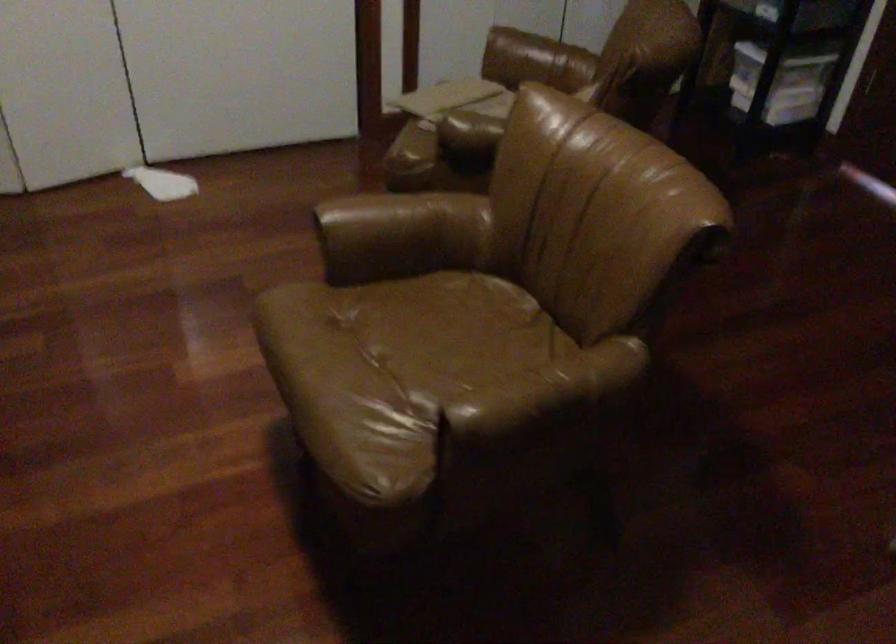
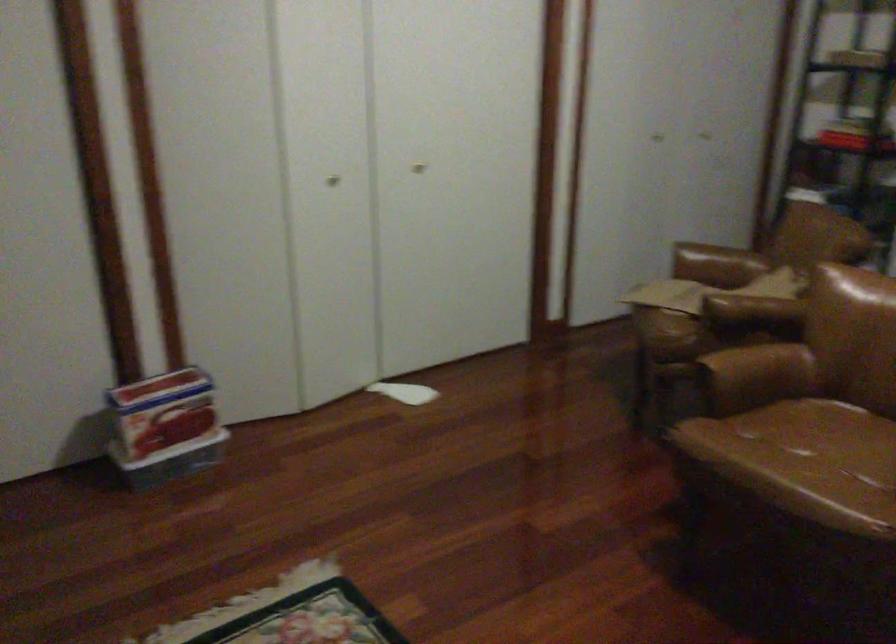
In a continuous first-person perspective shot, in which direction is the camera moving?

The cameraman moved toward left, backward.